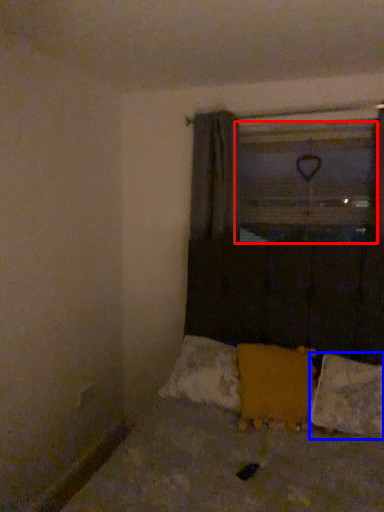
Question: Which of the following is the farthest to the observer, window screen (highlighted by a red box) or pillow (highlighted by a blue box)?

Choices:
 (A) window screen
 (B) pillow

Answer: (A)